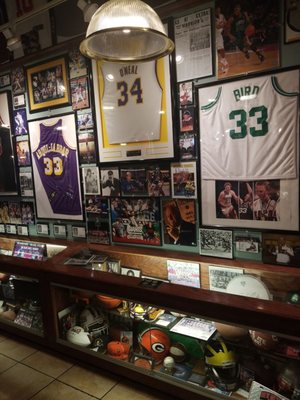
This screenshot has width=300, height=400. In order to click on display case in this screenshot , I will do `click(28, 309)`, `click(90, 316)`, `click(208, 339)`.